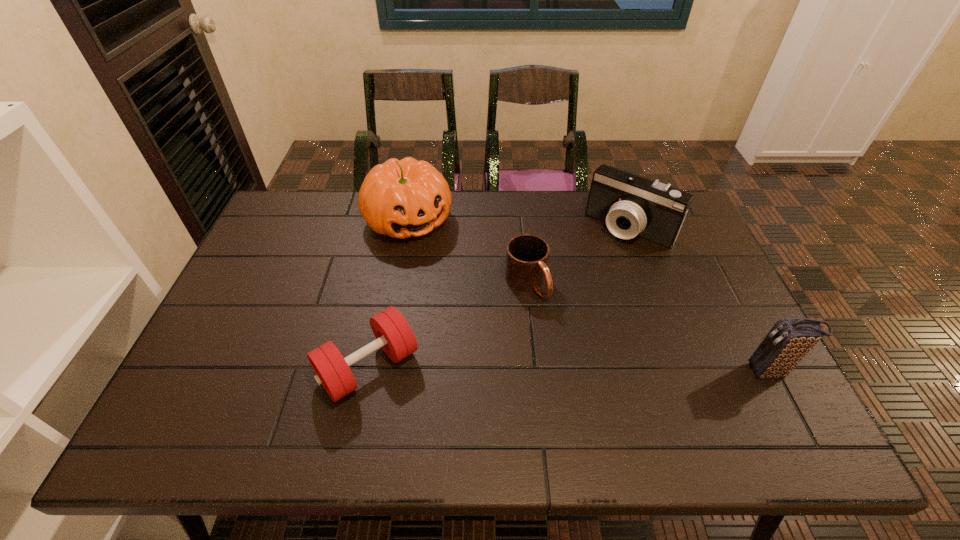
The height and width of the screenshot is (540, 960). In the image, there is a desktop. Find the location of `blank space at the right edge`. blank space at the right edge is located at coordinates (691, 322).

In the image, there is a desktop. Identify the location of free space at the far left corner. (279, 205).

In the image, there is a desktop. At what (x,y) coordinates should I click in order to perform the action: click on vacant area at the near left corner. Please return your answer as a coordinate pair (x, y). Looking at the image, I should click on (237, 383).

Image resolution: width=960 pixels, height=540 pixels. I want to click on vacant position at the near right corner of the desktop, so click(763, 405).

Where is `free space that is in between the pumpkin and the dumbbell`? Image resolution: width=960 pixels, height=540 pixels. free space that is in between the pumpkin and the dumbbell is located at coordinates (389, 293).

The image size is (960, 540). Identify the location of vacant space that is in between the clutch bag and the dumbbell. (569, 369).

The width and height of the screenshot is (960, 540). Find the location of `vacant area between the rightmost object and the camcorder`. vacant area between the rightmost object and the camcorder is located at coordinates (699, 299).

Where is `empty space between the rightmost object and the pumpkin`? The height and width of the screenshot is (540, 960). empty space between the rightmost object and the pumpkin is located at coordinates (589, 295).

The height and width of the screenshot is (540, 960). I want to click on vacant area that lies between the camcorder and the pumpkin, so click(518, 223).

Locate an element on the screen. free point between the third nearest object and the dumbbell is located at coordinates (447, 326).